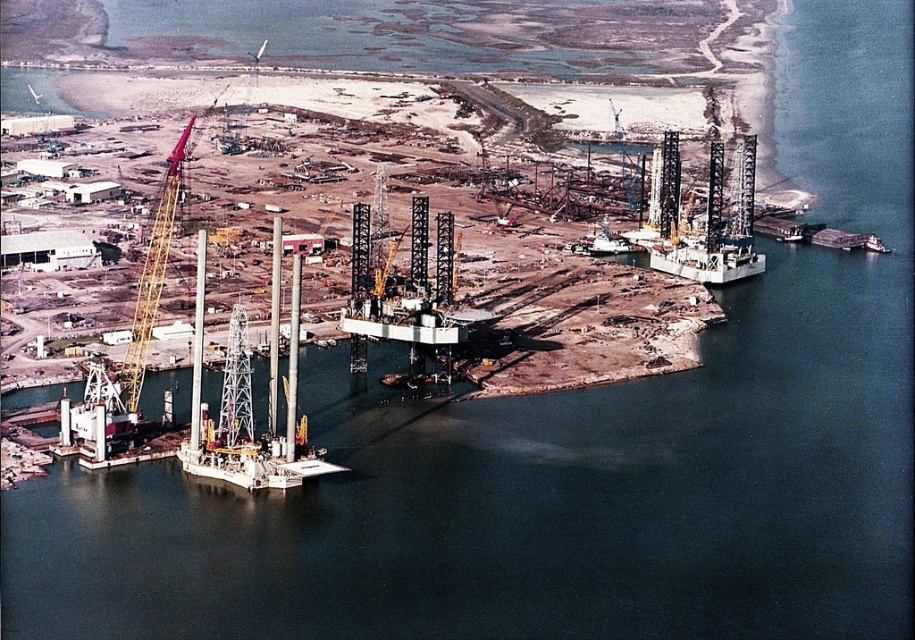
Is white matte oil rig at center-right taller than metallic gray ship at center?

Yes, white matte oil rig at center-right is taller than metallic gray ship at center.

In the scene shown: Is white matte oil rig at center-right positioned in front of metallic gray ship at center?

No, it is behind metallic gray ship at center.

Between point (734, 237) and point (591, 244), which one is positioned behind?

Positioned behind is point (734, 237).

In order to click on white matte oil rig at center-right in this screenshot , I will do `click(708, 259)`.

Which is more to the left, yellow metallic crane at left or white matte oil rig at center-right?

yellow metallic crane at left

Consider the image. Is yellow metallic crane at left in front of white matte oil rig at center-right?

No, it is not.

Who is more forward, (146,342) or (734,257)?

Point (146,342) is more forward.

The image size is (915, 640). In order to click on yellow metallic crane at left in this screenshot , I will do `click(152, 275)`.

Between yellow metallic crane at left and metallic gray ship at center, which one has less height?

Standing shorter between the two is metallic gray ship at center.

Who is more forward, (144, 284) or (609, 250)?

Point (609, 250) is in front.

Is point (128, 381) positioned in front of point (631, 248)?

No.

Locate an element on the screen. This screenshot has width=915, height=640. yellow metallic crane at left is located at coordinates (152, 275).